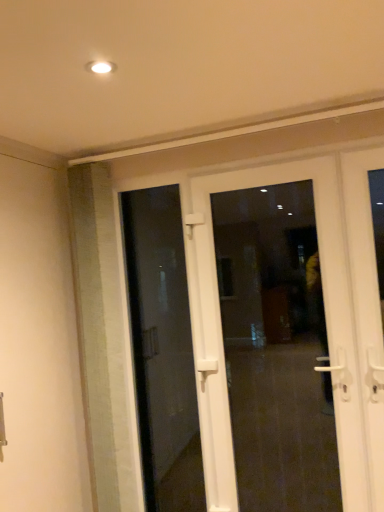
Locate an element on the screen. The height and width of the screenshot is (512, 384). white plastic door at center, which is the second door in back-to-front order is located at coordinates (221, 325).

Measure the distance between white plastic door at center, the 1th door positioned from the front, and camera.

white plastic door at center, the 1th door positioned from the front, and camera are 6.01 feet apart.

Describe the element at coordinates (221, 325) in the screenshot. This screenshot has height=512, width=384. I see `white plastic door at center, which is the second door in back-to-front order` at that location.

What do you see at coordinates (162, 350) in the screenshot? Image resolution: width=384 pixels, height=512 pixels. I see `transparent glass door at center, the 1th door when ordered from back to front` at bounding box center [162, 350].

Locate an element on the screen. transparent glass door at center, the second door viewed from the front is located at coordinates (162, 350).

Find the location of a particular element. The image size is (384, 512). white plastic door at center, which is the second door in back-to-front order is located at coordinates (221, 325).

Does white plastic door at center, the 1th door positioned from the front, appear on the right side of transparent glass door at center, the second door viewed from the front?

Yes.

Based on the photo, between white plastic door at center, the 1th door positioned from the front, and transparent glass door at center, the second door viewed from the front, which one is positioned behind?

transparent glass door at center, the second door viewed from the front, is behind.

Considering the positions of point (225, 475) and point (187, 328), is point (225, 475) closer or farther from the camera than point (187, 328)?

Point (225, 475) is closer to the camera than point (187, 328).

From the image's perspective, is white plastic door at center, the 1th door positioned from the front, located above or below transparent glass door at center, the 1th door when ordered from back to front?

Based on their image positions, white plastic door at center, the 1th door positioned from the front, is located beneath transparent glass door at center, the 1th door when ordered from back to front.

From a real-world perspective, is white plastic door at center, the 1th door positioned from the front, positioned above or below transparent glass door at center, the second door viewed from the front?

From a real-world perspective, white plastic door at center, the 1th door positioned from the front, is physically below transparent glass door at center, the second door viewed from the front.

Which of these two, white plastic door at center, the 1th door positioned from the front, or transparent glass door at center, the 1th door when ordered from back to front, is thinner?

transparent glass door at center, the 1th door when ordered from back to front, is thinner.

Can you confirm if white plastic door at center, which is the second door in back-to-front order, is taller than transparent glass door at center, the 1th door when ordered from back to front?

No.

Between white plastic door at center, which is the second door in back-to-front order, and transparent glass door at center, the 1th door when ordered from back to front, which one has larger size?

Bigger between the two is white plastic door at center, which is the second door in back-to-front order.

Is white plastic door at center, which is the second door in back-to-front order, inside or outside of transparent glass door at center, the second door viewed from the front?

The correct answer is: outside.

Based on the photo, does white plastic door at center, the 1th door positioned from the front, touch transparent glass door at center, the second door viewed from the front?

white plastic door at center, the 1th door positioned from the front, and transparent glass door at center, the second door viewed from the front, are not in contact.

Does white plastic door at center, the 1th door positioned from the front, turn towards transparent glass door at center, the second door viewed from the front?

Yes, white plastic door at center, the 1th door positioned from the front, is oriented towards transparent glass door at center, the second door viewed from the front.

Can you tell me how much white plastic door at center, the 1th door positioned from the front, and transparent glass door at center, the 1th door when ordered from back to front, differ in facing direction?

The angular difference between white plastic door at center, the 1th door positioned from the front, and transparent glass door at center, the 1th door when ordered from back to front, is 0.27 degrees.

What are the coordinates of `door that appears above the white plastic door at center, which is the second door in back-to-front order (from a real-world perspective)` in the screenshot? It's located at (162, 350).

Based on the photo, visually, is transparent glass door at center, the 1th door when ordered from back to front, positioned to the left or to the right of white plastic door at center, which is the second door in back-to-front order?

transparent glass door at center, the 1th door when ordered from back to front, is to the left of white plastic door at center, which is the second door in back-to-front order.

Does transparent glass door at center, the 1th door when ordered from back to front, lie in front of white plastic door at center, the 1th door positioned from the front?

No, it is not.

Does point (173, 223) lie in front of point (188, 238)?

No.

From the image's perspective, does transparent glass door at center, the second door viewed from the front, appear higher than white plastic door at center, the 1th door positioned from the front?

Indeed, from the image's perspective, transparent glass door at center, the second door viewed from the front, is shown above white plastic door at center, the 1th door positioned from the front.

From a real-world perspective, is transparent glass door at center, the 1th door when ordered from back to front, below white plastic door at center, the 1th door positioned from the front?

Incorrect, from a real-world perspective, transparent glass door at center, the 1th door when ordered from back to front, is higher than white plastic door at center, the 1th door positioned from the front.

Is transparent glass door at center, the 1th door when ordered from back to front, wider than white plastic door at center, the 1th door positioned from the front?

In fact, transparent glass door at center, the 1th door when ordered from back to front, might be narrower than white plastic door at center, the 1th door positioned from the front.

Does transparent glass door at center, the second door viewed from the front, have a lesser height compared to white plastic door at center, the 1th door positioned from the front?

No.

Is transparent glass door at center, the 1th door when ordered from back to front, bigger than white plastic door at center, the 1th door positioned from the front?

No, transparent glass door at center, the 1th door when ordered from back to front, is not bigger than white plastic door at center, the 1th door positioned from the front.

Is transparent glass door at center, the 1th door when ordered from back to front, inside the boundaries of white plastic door at center, the 1th door positioned from the front, or outside?

The correct answer is: inside.

Are transparent glass door at center, the second door viewed from the front, and white plastic door at center, which is the second door in back-to-front order, making contact?

There is a gap between transparent glass door at center, the second door viewed from the front, and white plastic door at center, which is the second door in back-to-front order.

Is transparent glass door at center, the second door viewed from the front, facing towards white plastic door at center, which is the second door in back-to-front order?

Yes.

This screenshot has width=384, height=512. I want to click on door above the white plastic door at center, the 1th door positioned from the front (from a real-world perspective), so click(162, 350).

Identify the location of door above the white plastic door at center, which is the second door in back-to-front order (from the image's perspective). The height and width of the screenshot is (512, 384). (162, 350).

Where is `door that appears behind the white plastic door at center, which is the second door in back-to-front order`? The width and height of the screenshot is (384, 512). door that appears behind the white plastic door at center, which is the second door in back-to-front order is located at coordinates (162, 350).